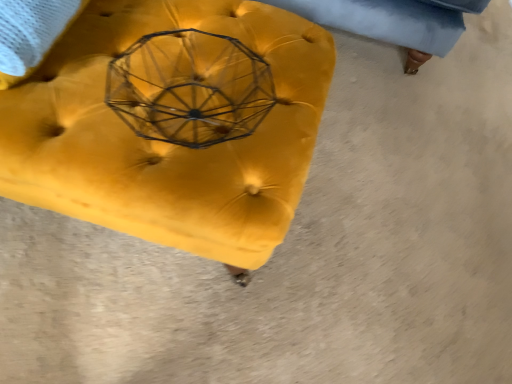
The width and height of the screenshot is (512, 384). What do you see at coordinates (173, 124) in the screenshot?
I see `velvet yellow ottoman at center` at bounding box center [173, 124].

At what (x,y) coordinates should I click in order to perform the action: click on velvet yellow ottoman at center. Please return your answer as a coordinate pair (x, y). This screenshot has height=384, width=512. Looking at the image, I should click on (173, 124).

This screenshot has height=384, width=512. I want to click on velvet yellow ottoman at center, so click(173, 124).